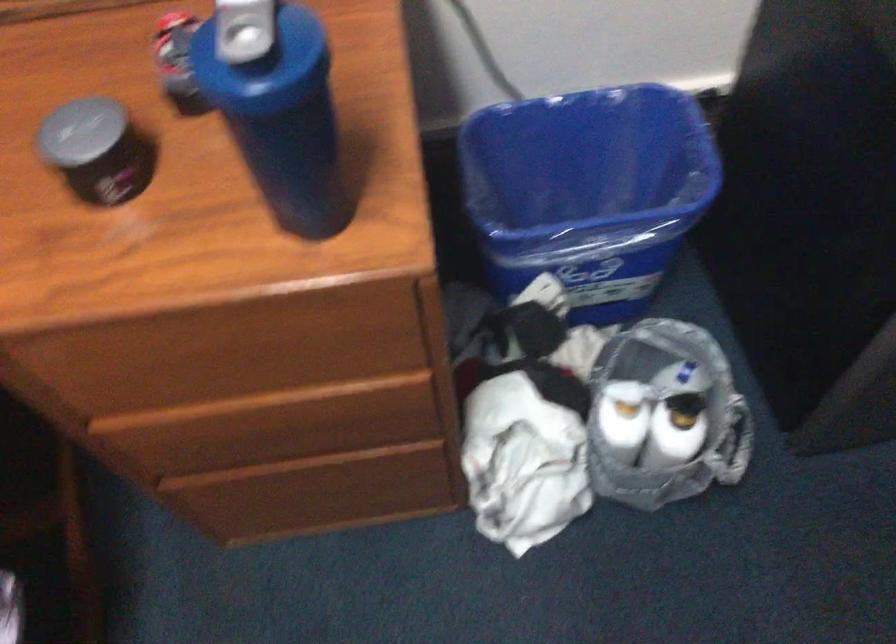
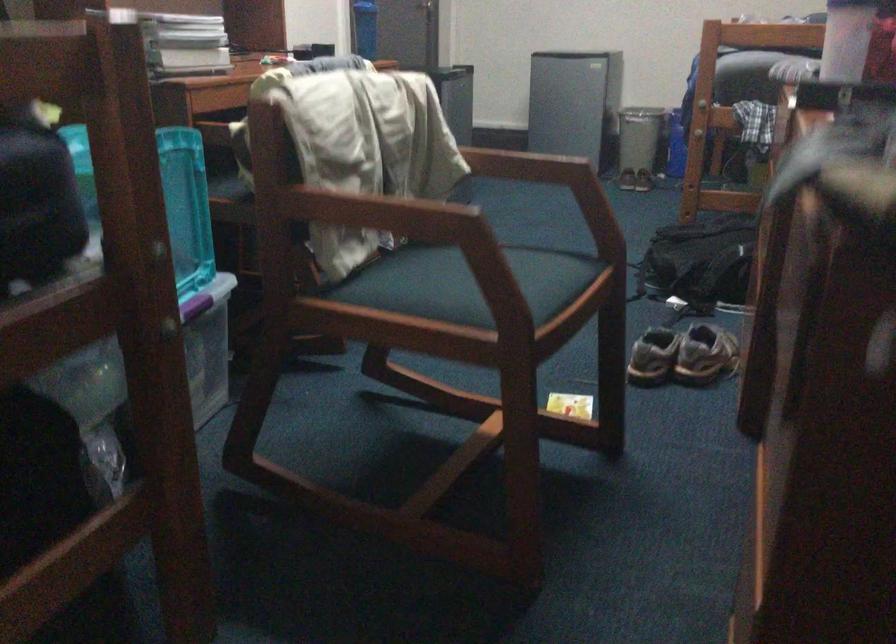
In the second image, find the point that corresponds to the point at 225,205 in the first image.

(365, 28)